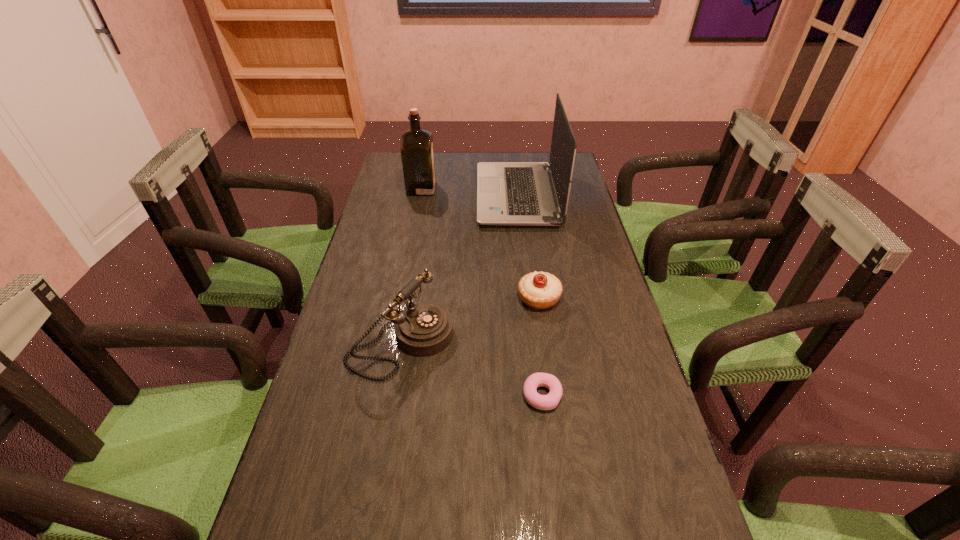
Find the location of a particular element. laptop computer is located at coordinates (508, 193).

Where is `liquor`? Image resolution: width=960 pixels, height=540 pixels. liquor is located at coordinates (417, 153).

Locate an element on the screen. This screenshot has height=540, width=960. the third tallest object is located at coordinates (425, 329).

This screenshot has height=540, width=960. I want to click on the farther pastry, so click(539, 290).

This screenshot has width=960, height=540. In order to click on the fourth tallest object in this screenshot , I will do `click(539, 290)`.

Locate an element on the screen. The width and height of the screenshot is (960, 540). the shorter pastry is located at coordinates (543, 402).

Where is `the shortest object`? the shortest object is located at coordinates (543, 402).

Where is `vacant space located on the screen of the laptop computer`? The width and height of the screenshot is (960, 540). vacant space located on the screen of the laptop computer is located at coordinates (428, 195).

The width and height of the screenshot is (960, 540). Identify the location of vacant space situated on the screen of the laptop computer. 407,195.

The height and width of the screenshot is (540, 960). I want to click on blank area located 0.060m on the screen of the laptop computer, so click(461, 195).